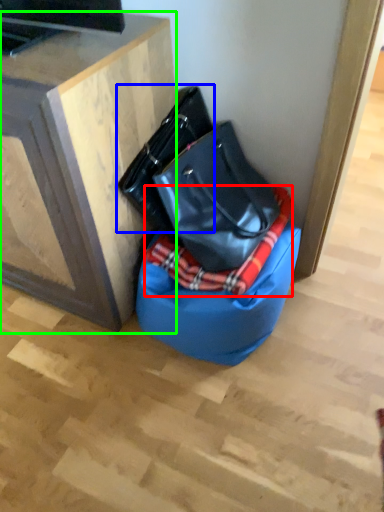
Question: Which is nearer to the blanket (highlighted by a red box)? handbag (highlighted by a blue box) or furniture (highlighted by a green box).

Choices:
 (A) handbag
 (B) furniture

Answer: (A)